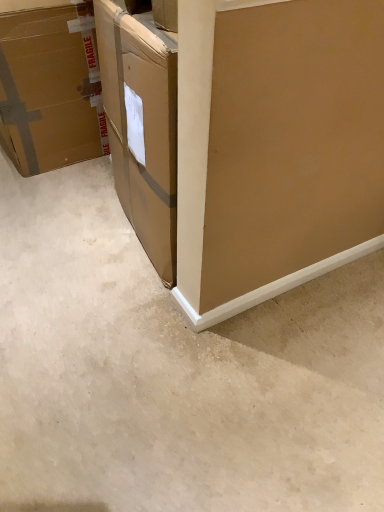
Question: Is point [x=1, y=434] positioned closer to the camera than point [x=43, y=94]?

Choices:
 (A) farther
 (B) closer

Answer: (B)

Question: From the image's perspective, relative to brown cardboard box at left, is beige carpet at lower left above or below?

Choices:
 (A) below
 (B) above

Answer: (A)

Question: In the image, is beige carpet at lower left on the left side or the right side of brown cardboard box at left?

Choices:
 (A) right
 (B) left

Answer: (A)

Question: In the image, is brown cardboard box at left positioned in front of or behind beige carpet at lower left?

Choices:
 (A) behind
 (B) front

Answer: (A)

Question: From the image's perspective, is brown cardboard box at left positioned above or below beige carpet at lower left?

Choices:
 (A) below
 (B) above

Answer: (B)

Question: Do you think brown cardboard box at left is within beige carpet at lower left, or outside of it?

Choices:
 (A) outside
 (B) inside

Answer: (A)

Question: Is brown cardboard box at left bigger or smaller than beige carpet at lower left?

Choices:
 (A) big
 (B) small

Answer: (A)